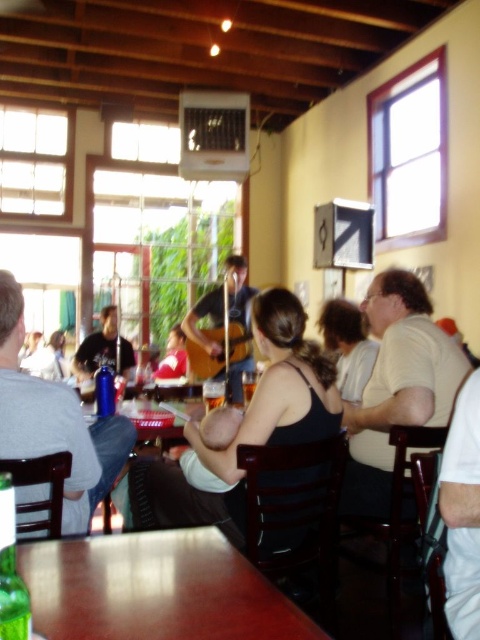
Question: Is matte brown guitar at center further to camera compared to matte black shirt at center?

Choices:
 (A) no
 (B) yes

Answer: (A)

Question: Where is matte brown guitar at center located in relation to matte red shirt at center in the image?

Choices:
 (A) below
 (B) above

Answer: (B)

Question: Which of the following is the farthest from the observer?

Choices:
 (A) matte brown guitar at center
 (B) matte black shirt at center
 (C) matte red shirt at center

Answer: (C)

Question: Can you confirm if brown wooden table at lower center is thinner than matte black shirt at center?

Choices:
 (A) yes
 (B) no

Answer: (B)

Question: Which object appears closest to the camera in this image?

Choices:
 (A) brown wooden table at lower center
 (B) matte red shirt at center
 (C) matte black shirt at center
 (D) matte brown guitar at center

Answer: (A)

Question: Which object is the closest to the matte brown guitar at center?

Choices:
 (A) matte black shirt at center
 (B) matte red shirt at center

Answer: (A)